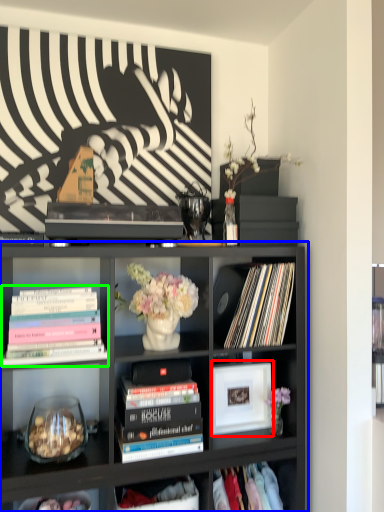
Question: Which object is the closest to the picture frame (highlighted by a red box)? Choose among these: bookcase (highlighted by a blue box) or book (highlighted by a green box).

Choices:
 (A) bookcase
 (B) book

Answer: (A)